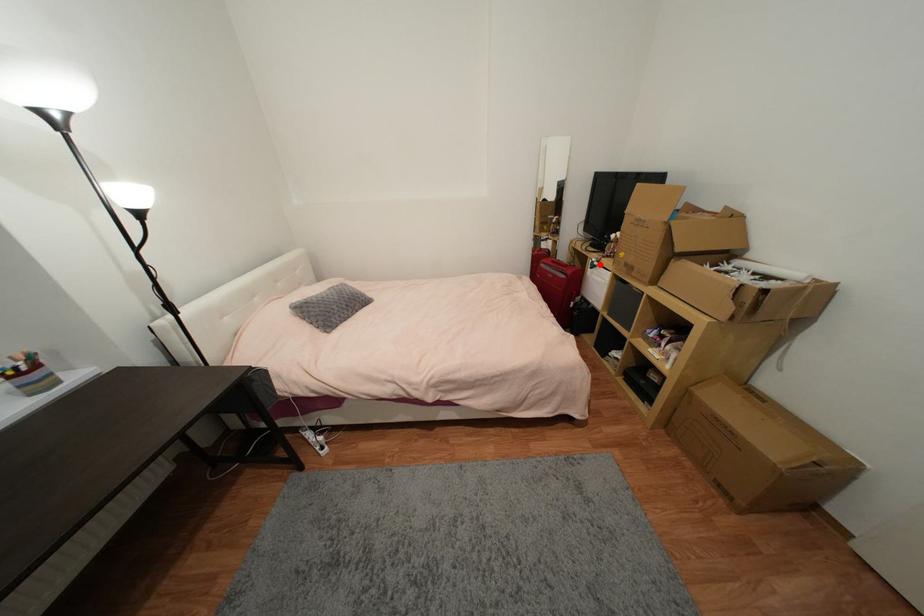
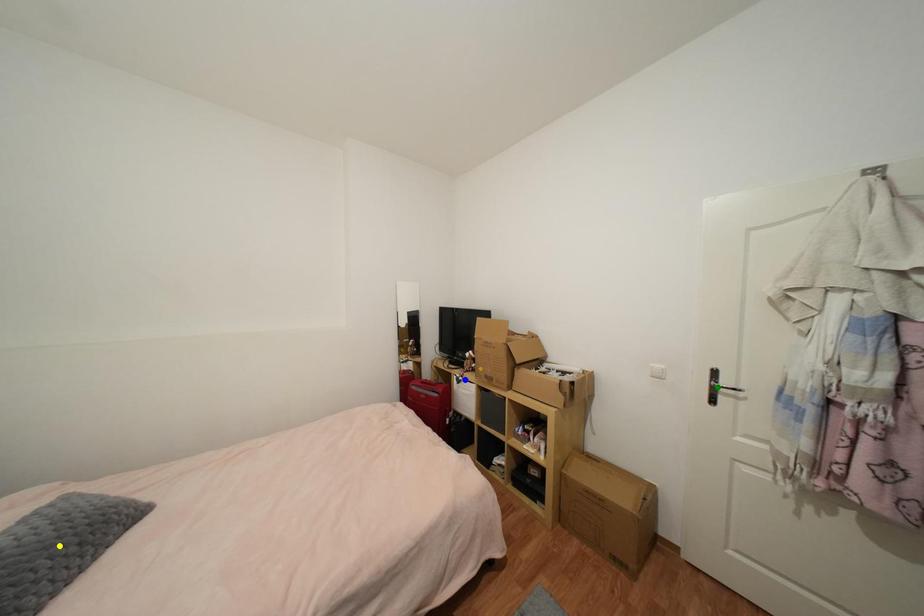
Question: I am providing you with two images of the same scene from different viewpoints. A red point is marked on the first image. You are given multiple points on the second image. Can you choose the point in image 2 that corresponds to the point in image 1?

Choices:
 (A) green point
 (B) yellow point
 (C) blue point

Answer: (C)